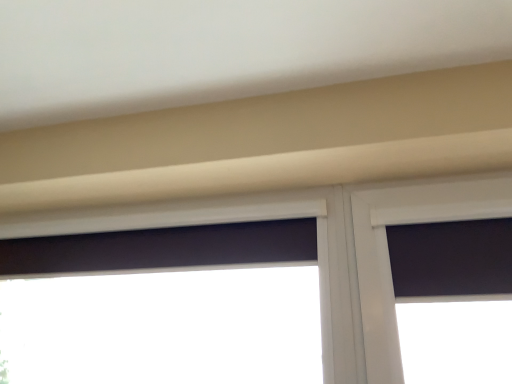
The height and width of the screenshot is (384, 512). Describe the element at coordinates (323, 248) in the screenshot. I see `white plastic window at center` at that location.

I want to click on white plastic window at center, so click(x=323, y=248).

Find the location of `white plastic window at center`. white plastic window at center is located at coordinates (323, 248).